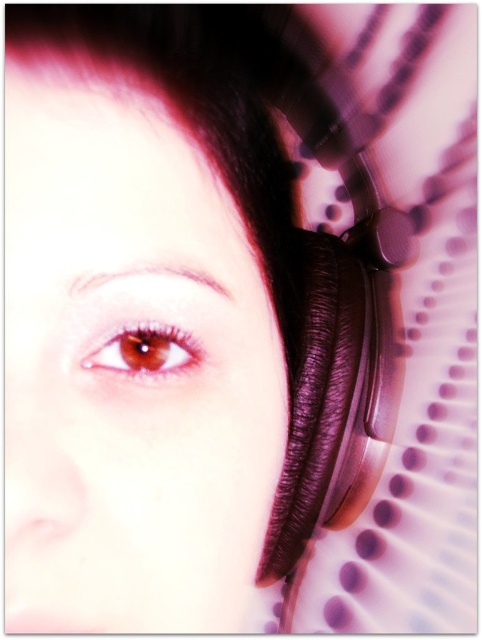
Question: Estimate the real-world distances between objects in this image. Which object is closer to the brown matte eye at center?

Choices:
 (A) matte black headphones at right
 (B) satin brown earphone at right

Answer: (A)

Question: Does matte black headphones at right have a greater width compared to brown matte eye at center?

Choices:
 (A) yes
 (B) no

Answer: (A)

Question: Which point is closer to the camera?

Choices:
 (A) (276, 502)
 (B) (288, 276)
 (C) (190, 356)

Answer: (C)

Question: Estimate the real-world distances between objects in this image. Which object is closer to the satin brown earphone at right?

Choices:
 (A) matte black headphones at right
 (B) brown matte eye at center

Answer: (A)

Question: Is matte black headphones at right positioned at the back of satin brown earphone at right?

Choices:
 (A) no
 (B) yes

Answer: (A)

Question: Considering the relative positions of matte black headphones at right and brown matte eye at center in the image provided, where is matte black headphones at right located with respect to brown matte eye at center?

Choices:
 (A) right
 (B) left

Answer: (A)